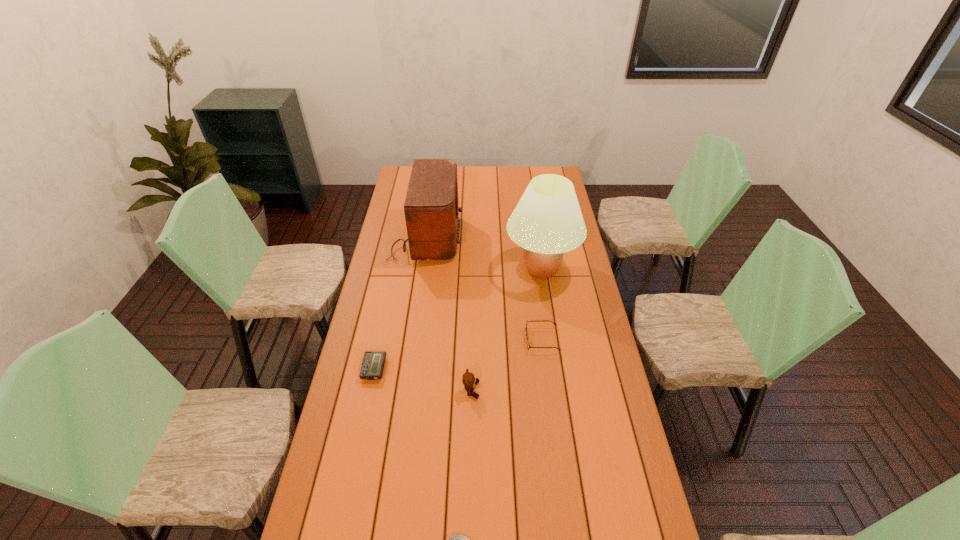
Identify the location of vacant space that's between the tallest object and the radio receiver. (484, 253).

Where is `unoccupied position between the radio receiver and the fourth shortest object`? unoccupied position between the radio receiver and the fourth shortest object is located at coordinates (448, 314).

Locate an element on the screen. free spot between the teddy bear and the beeper is located at coordinates (422, 380).

Locate an element on the screen. Image resolution: width=960 pixels, height=540 pixels. empty space between the lampshade and the spectacles is located at coordinates (541, 305).

Find the location of a particular element. This screenshot has width=960, height=540. vacant area that lies between the radio receiver and the fourth shortest object is located at coordinates (448, 314).

Locate an element on the screen. free point between the beeper and the lampshade is located at coordinates (458, 319).

Locate an element on the screen. The height and width of the screenshot is (540, 960). vacant area between the beeper and the second tallest object is located at coordinates (399, 303).

Find the location of a particular element. The width and height of the screenshot is (960, 540). blank region between the teddy bear and the fifth shortest object is located at coordinates (448, 314).

Image resolution: width=960 pixels, height=540 pixels. I want to click on object that is the fifth closest to the beeper, so click(547, 221).

Locate which object is the second closest to the second tallest object. Please provide its 2D coordinates. Your answer should be formatted as a tuple, i.e. [(x, y)], where the tuple contains the x and y coordinates of a point satisfying the conditions above.

[(528, 346)]